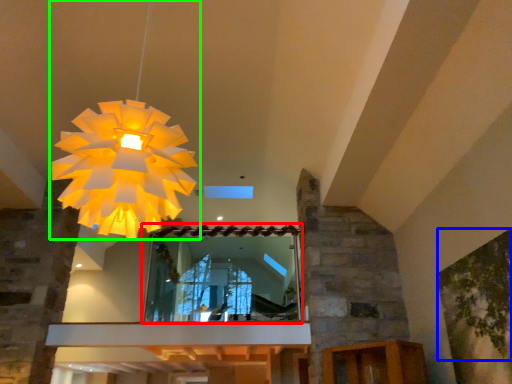
Question: Which object is positioned farthest from mirror (highlighted by a red box)? Select from tree (highlighted by a blue box) and lamp (highlighted by a green box).

Choices:
 (A) tree
 (B) lamp

Answer: (B)